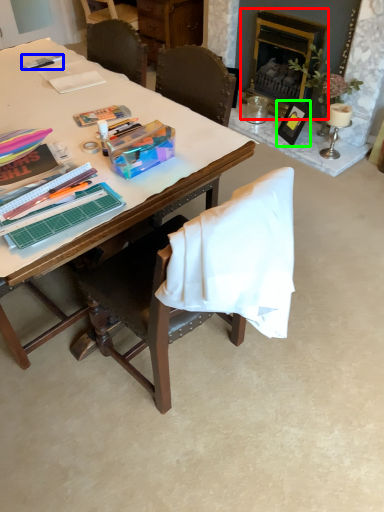
Question: Estimate the real-world distances between objects in this image. Which object is farther from fireplace (highlighted by a red box), pen (highlighted by a blue box) or picture frame (highlighted by a green box)?

Choices:
 (A) pen
 (B) picture frame

Answer: (A)